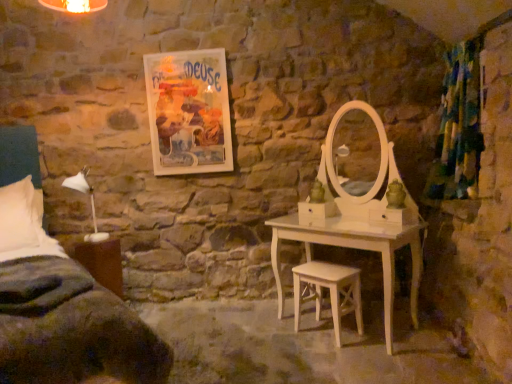
Question: Is matte paper poster at upper center shorter than white matte table lamp at left?

Choices:
 (A) no
 (B) yes

Answer: (A)

Question: Is matte paper poster at upper center far from white matte table lamp at left?

Choices:
 (A) yes
 (B) no

Answer: (B)

Question: Does matte paper poster at upper center appear on the right side of white matte table lamp at left?

Choices:
 (A) yes
 (B) no

Answer: (A)

Question: Does matte paper poster at upper center have a lesser width compared to white matte table lamp at left?

Choices:
 (A) no
 (B) yes

Answer: (B)

Question: Is matte paper poster at upper center in contact with white matte table lamp at left?

Choices:
 (A) yes
 (B) no

Answer: (B)

Question: Can you confirm if matte paper poster at upper center is wider than white matte table lamp at left?

Choices:
 (A) yes
 (B) no

Answer: (B)

Question: Is the position of white matte table lamp at left more distant than that of textured green curtain at right?

Choices:
 (A) yes
 (B) no

Answer: (B)

Question: From a real-world perspective, is white matte table lamp at left on top of textured green curtain at right?

Choices:
 (A) yes
 (B) no

Answer: (B)

Question: From a real-world perspective, is white matte table lamp at left beneath textured green curtain at right?

Choices:
 (A) no
 (B) yes

Answer: (B)

Question: Does white matte table lamp at left have a larger size compared to textured green curtain at right?

Choices:
 (A) no
 (B) yes

Answer: (A)

Question: Considering the relative sizes of white matte table lamp at left and textured green curtain at right in the image provided, is white matte table lamp at left thinner than textured green curtain at right?

Choices:
 (A) no
 (B) yes

Answer: (A)

Question: From the image's perspective, is white matte table lamp at left on textured green curtain at right?

Choices:
 (A) no
 (B) yes

Answer: (A)

Question: From a real-world perspective, is textured green curtain at right over dark green fabric bed at left?

Choices:
 (A) yes
 (B) no

Answer: (A)